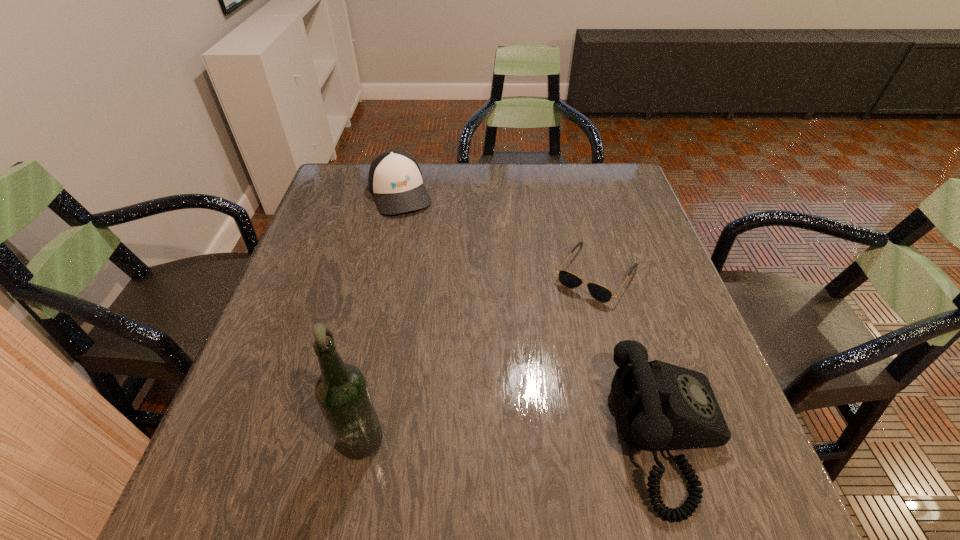
I want to click on vacant space on the desktop that is between the beer bottle and the telephone and is positioned on the front panel of the cap, so click(506, 434).

Where is `free space on the desktop that is between the beer bottle and the telephone and is positioned on the front-facing side of the shortest object`? The image size is (960, 540). free space on the desktop that is between the beer bottle and the telephone and is positioned on the front-facing side of the shortest object is located at coordinates (487, 434).